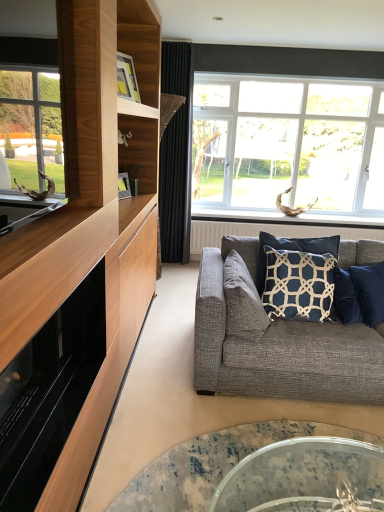
Identify the location of empty space that is ontop of black velvet curtain at center. (177, 39).